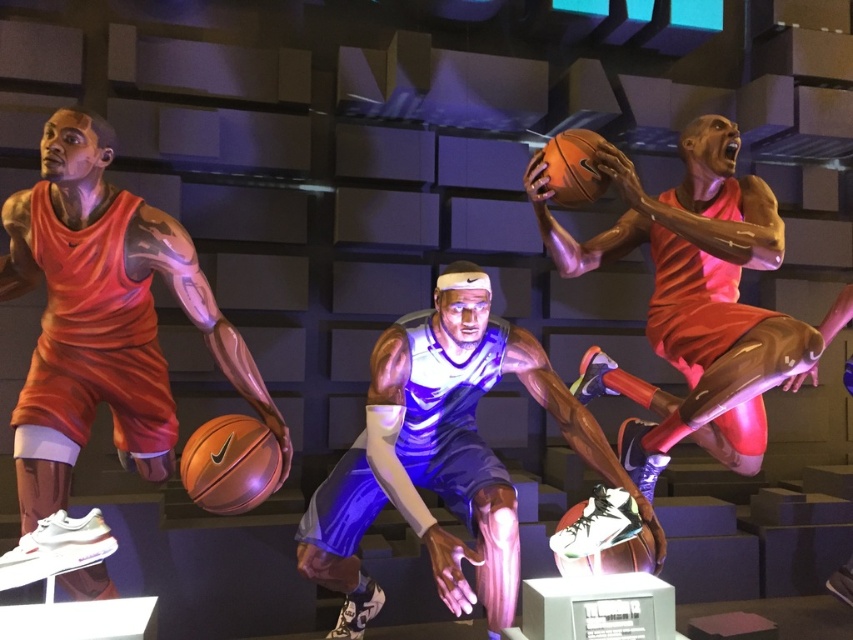
You are a photographer setting up a shot of the basketball sculptures. You need to ensure the shiny blue jersey at center and the orange matte basketball at upper right are both in frame. Based on their positions, which object should you adjust your camera angle to focus on first to capture both?

The shiny blue jersey at center is positioned on the left side of the orange matte basketball at upper right, so you should first focus on the orange matte basketball at upper right to ensure both objects are within the frame.

Based on the coordinates provided, where is the shiny blue jersey at center located in the image?

The shiny blue jersey at center is located at point coordinates of 0.714 on the x axis and 0.521 on the y axis.